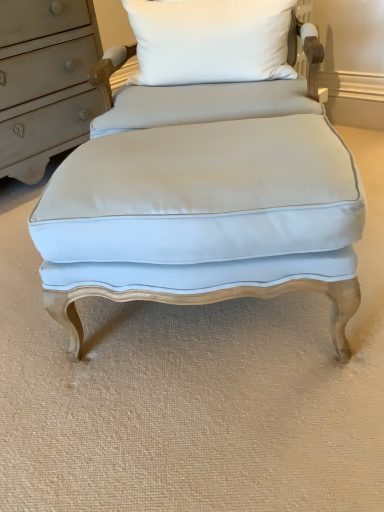
The height and width of the screenshot is (512, 384). I want to click on light blue fabric ottoman at center, so click(204, 173).

In order to face light blue fabric ottoman at center, should I rotate leftwards or rightwards?

It's best to rotate right around 1.340 degrees.

What do you see at coordinates (204, 173) in the screenshot? This screenshot has height=512, width=384. I see `light blue fabric ottoman at center` at bounding box center [204, 173].

In order to face white fabric pillow at upper center, should I rotate leftwards or rightwards?

It's best to rotate right around 2.335 degrees.

What do you see at coordinates (210, 40) in the screenshot? The image size is (384, 512). I see `white fabric pillow at upper center` at bounding box center [210, 40].

This screenshot has width=384, height=512. I want to click on white fabric pillow at upper center, so click(210, 40).

You are a GUI agent. You are given a task and a screenshot of the screen. Output one action in this format:
    pyautogui.click(x=<x>, y=<y>)
    Task: Click on the light blue fabric ottoman at center
    The width and height of the screenshot is (384, 512).
    Given the screenshot: What is the action you would take?
    pyautogui.click(x=204, y=173)

Can you confirm if light blue fabric ottoman at center is positioned to the left of white fabric pillow at upper center?

Indeed, light blue fabric ottoman at center is positioned on the left side of white fabric pillow at upper center.

Is light blue fabric ottoman at center closer to the viewer compared to white fabric pillow at upper center?

Yes, light blue fabric ottoman at center is closer to the viewer.

Is point (205, 94) behind point (207, 24)?

No, it is in front of (207, 24).

From the image's perspective, is light blue fabric ottoman at center located above or below white fabric pillow at upper center?

light blue fabric ottoman at center is situated lower than white fabric pillow at upper center in the image.

From a real-world perspective, is light blue fabric ottoman at center beneath white fabric pillow at upper center?

Yes, from a real-world perspective, light blue fabric ottoman at center is beneath white fabric pillow at upper center.

Looking at their sizes, would you say light blue fabric ottoman at center is wider or thinner than white fabric pillow at upper center?

Considering their sizes, light blue fabric ottoman at center looks broader than white fabric pillow at upper center.

Who is shorter, light blue fabric ottoman at center or white fabric pillow at upper center?

white fabric pillow at upper center is shorter.

From the picture: Considering the relative sizes of light blue fabric ottoman at center and white fabric pillow at upper center in the image provided, is light blue fabric ottoman at center bigger than white fabric pillow at upper center?

Yes.

Would you say light blue fabric ottoman at center is outside white fabric pillow at upper center?

light blue fabric ottoman at center lies outside white fabric pillow at upper center's area.

Does light blue fabric ottoman at center touch white fabric pillow at upper center?

There is a gap between light blue fabric ottoman at center and white fabric pillow at upper center.

Is light blue fabric ottoman at center turned away from white fabric pillow at upper center?

light blue fabric ottoman at center is not turned away from white fabric pillow at upper center.

How different are the orientations of light blue fabric ottoman at center and white fabric pillow at upper center in degrees?

The angle between the facing direction of light blue fabric ottoman at center and the facing direction of white fabric pillow at upper center is 173 degrees.

Measure the distance between light blue fabric ottoman at center and white fabric pillow at upper center.

light blue fabric ottoman at center is 24.34 centimeters away from white fabric pillow at upper center.

The width and height of the screenshot is (384, 512). Find the location of `pillow behind the light blue fabric ottoman at center`. pillow behind the light blue fabric ottoman at center is located at coordinates (210, 40).

Which is more to the right, white fabric pillow at upper center or light blue fabric ottoman at center?

From the viewer's perspective, white fabric pillow at upper center appears more on the right side.

Which object is further away from the camera taking this photo, white fabric pillow at upper center or light blue fabric ottoman at center?

Positioned behind is white fabric pillow at upper center.

Is point (247, 9) farther from viewer compared to point (157, 130)?

Yes, it is behind point (157, 130).

From the image's perspective, who appears lower, white fabric pillow at upper center or light blue fabric ottoman at center?

light blue fabric ottoman at center, from the image's perspective.

From a real-world perspective, between white fabric pillow at upper center and light blue fabric ottoman at center, who is vertically higher?

white fabric pillow at upper center, from a real-world perspective.

In terms of width, does white fabric pillow at upper center look wider or thinner when compared to light blue fabric ottoman at center?

In the image, white fabric pillow at upper center appears to be more narrow than light blue fabric ottoman at center.

Considering the relative sizes of white fabric pillow at upper center and light blue fabric ottoman at center in the image provided, is white fabric pillow at upper center taller than light blue fabric ottoman at center?

No.

Based on their sizes in the image, would you say white fabric pillow at upper center is bigger or smaller than light blue fabric ottoman at center?

Considering their sizes, white fabric pillow at upper center takes up less space than light blue fabric ottoman at center.

Would you say light blue fabric ottoman at center is part of white fabric pillow at upper center's contents?

Definitely not — light blue fabric ottoman at center is not inside white fabric pillow at upper center.

Is white fabric pillow at upper center not close to light blue fabric ottoman at center?

No, white fabric pillow at upper center is not far away from light blue fabric ottoman at center.

Is white fabric pillow at upper center turned away from light blue fabric ottoman at center?

No, light blue fabric ottoman at center is not at the back of white fabric pillow at upper center.

I want to click on pillow above the light blue fabric ottoman at center (from a real-world perspective), so click(210, 40).

Locate an element on the screen. pillow behind the light blue fabric ottoman at center is located at coordinates (210, 40).

Where is `swivel chair on the left of white fabric pillow at upper center`? swivel chair on the left of white fabric pillow at upper center is located at coordinates (204, 173).